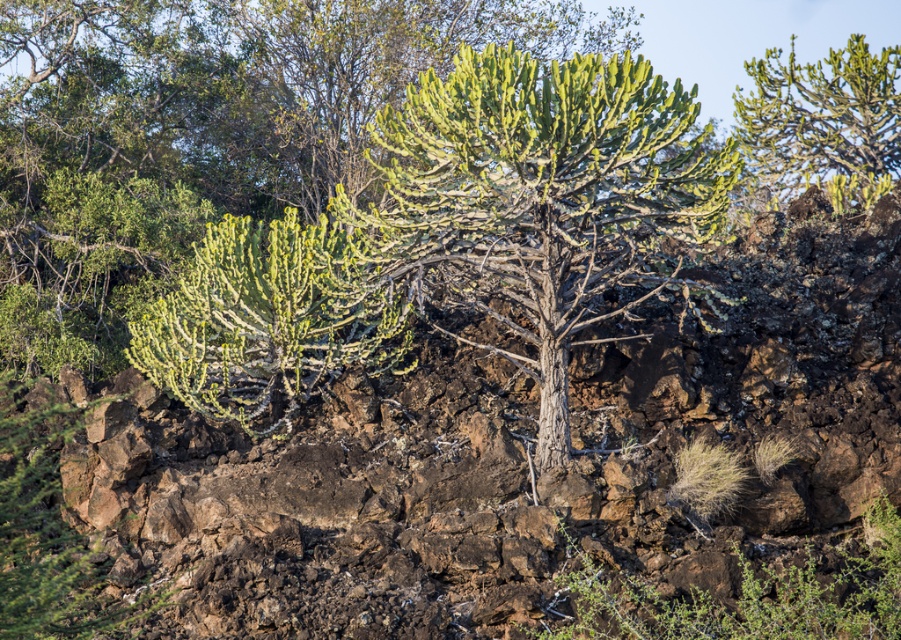
Does green succulent at center have a lesser width compared to green spiny plant at upper right?

Yes, green succulent at center is thinner than green spiny plant at upper right.

Which of these two, green succulent at center or green spiny plant at upper right, stands taller?

With more height is green succulent at center.

Is point (504, 349) farther from camera compared to point (777, 97)?

No, it is not.

Locate an element on the screen. The height and width of the screenshot is (640, 901). green succulent at center is located at coordinates (542, 198).

Consider the image. Is green spiny plant at center to the right of green succulent at center from the viewer's perspective?

Incorrect, green spiny plant at center is not on the right side of green succulent at center.

Can you confirm if green spiny plant at center is shorter than green succulent at center?

In fact, green spiny plant at center may be taller than green succulent at center.

Does point (801, 321) come behind point (449, 180)?

Yes, it is.

Locate an element on the screen. This screenshot has height=640, width=901. green spiny plant at center is located at coordinates (508, 460).

Does green spiny plant at center have a lesser height compared to green spiny plant at upper right?

No, green spiny plant at center is not shorter than green spiny plant at upper right.

Which is behind, point (667, 481) or point (818, 109)?

Point (818, 109)

Between point (370, 406) and point (897, 45), which one is positioned in front?

Point (370, 406)

Identify the location of green spiny plant at center. [508, 460].